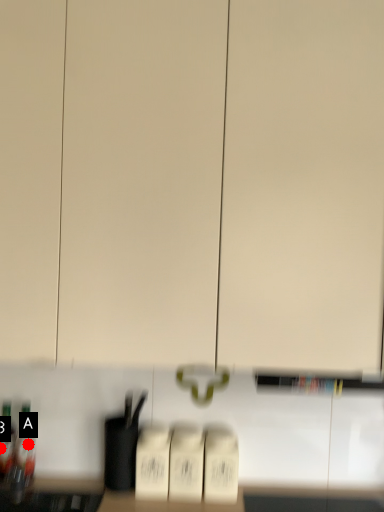
Question: Two points are circled on the image, labeled by A and B beside each circle. Which point appears closest to the camera in this image?

Choices:
 (A) A is closer
 (B) B is closer

Answer: (B)